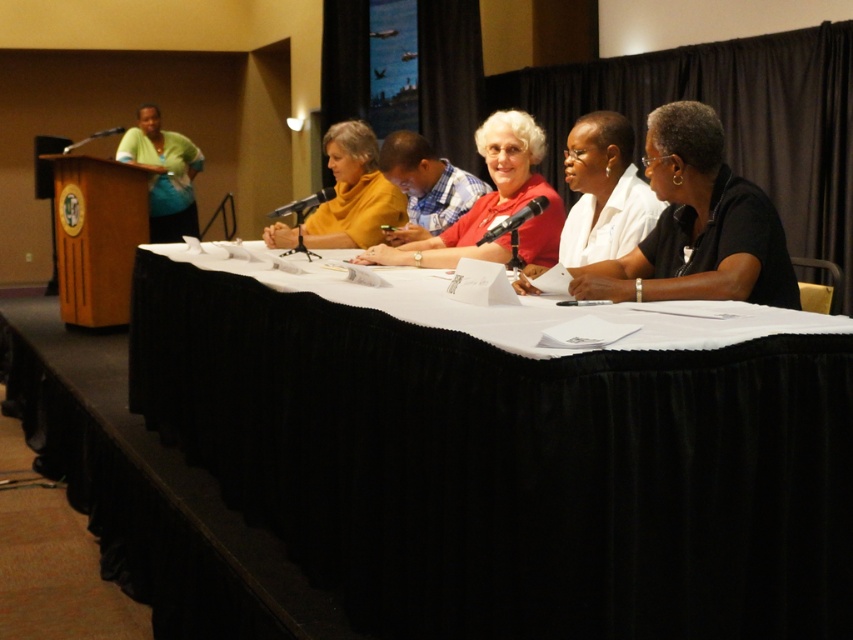
Does point (461, 221) lie behind point (175, 228)?

No, it is in front of (175, 228).

Is matte red shirt at center smaller than matte green blouse at left?

Indeed, matte red shirt at center has a smaller size compared to matte green blouse at left.

Measure the distance between point (473, 248) and camera.

Point (473, 248) is 3.02 meters from camera.

The image size is (853, 640). Identify the location of matte red shirt at center. click(x=491, y=205).

What do you see at coordinates (697, 225) in the screenshot? The height and width of the screenshot is (640, 853). I see `black matte shirt at right` at bounding box center [697, 225].

Between point (643, 273) and point (355, 224), which one is positioned behind?

Point (355, 224)

What are the coordinates of `black matte shirt at right` in the screenshot? It's located at (697, 225).

Can you confirm if plaid shirt at center is bigger than matte green blouse at left?

Incorrect, plaid shirt at center is not larger than matte green blouse at left.

Consider the image. Who is more forward, [444,208] or [163,227]?

Positioned in front is point [444,208].

The width and height of the screenshot is (853, 640). I want to click on plaid shirt at center, so click(x=425, y=186).